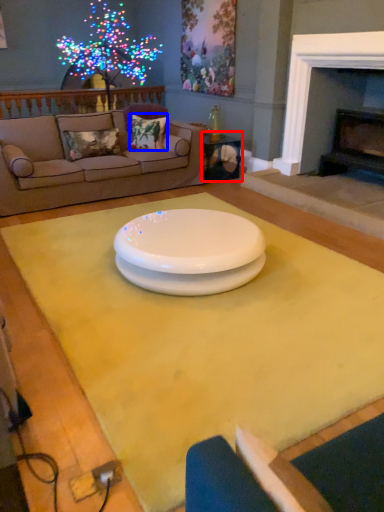
Question: Which point is closer to the camera, table (highlighted by a red box) or pillow (highlighted by a blue box)?

Choices:
 (A) table
 (B) pillow

Answer: (B)